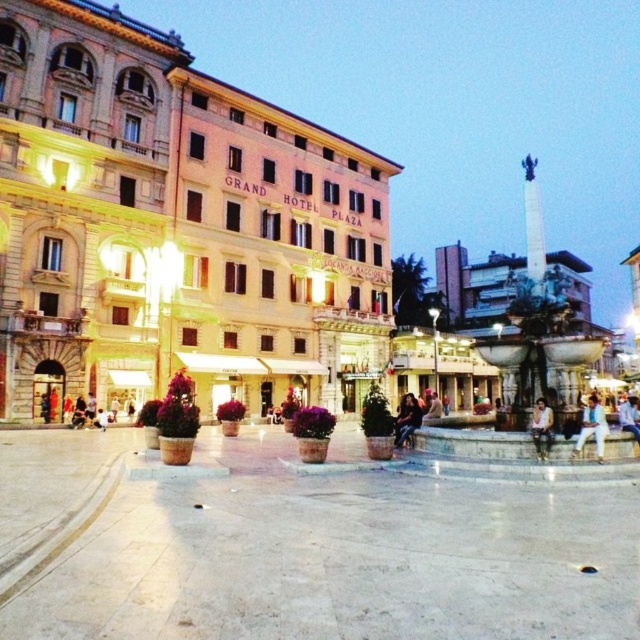
Based on the scene description, where is the white marble fountain at center located in the image?

The white marble fountain at center is located at point (532, 371).

You are standing in the plaza and want to take a photo. You notice two points marked in the scene. Which point, point (596, 433) or point (403, 403), is closer to you?

Point (596, 433) is closer to you than point (403, 403).

You are a tourist holding a light brown leather jacket at lower right and want to take a photo of the white marble fountain at center. Which direction should you move to frame the fountain properly?

The white marble fountain at center is positioned on the right side of the light brown leather jacket at lower right. To frame the fountain properly, you should move to the left to position yourself so the fountain is centered in your viewfinder.